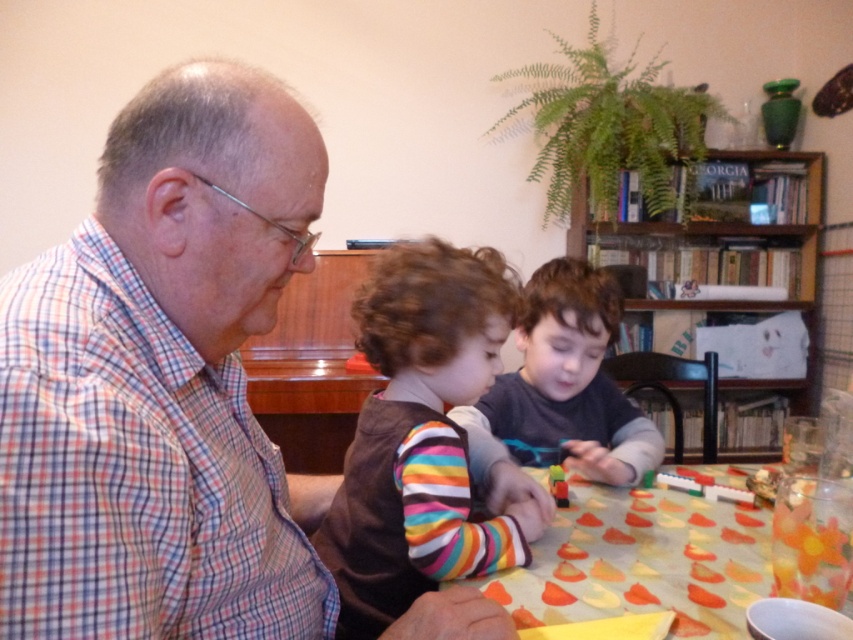
From the picture: Can you confirm if yellow paper at center is positioned to the right of dark gray sweater at center?

Yes, yellow paper at center is to the right of dark gray sweater at center.

Can you confirm if yellow paper at center is smaller than dark gray sweater at center?

Correct, yellow paper at center occupies less space than dark gray sweater at center.

This screenshot has height=640, width=853. What do you see at coordinates (642, 563) in the screenshot? I see `yellow paper at center` at bounding box center [642, 563].

I want to click on yellow paper at center, so (642, 563).

Is point (360, 627) positioned in front of point (643, 532)?

Yes.

Does brown fabric shirt at center appear under yellow paper at center?

Actually, brown fabric shirt at center is above yellow paper at center.

Is point (421, 538) positioned after point (555, 602)?

Yes, point (421, 538) is behind point (555, 602).

Locate an element on the screen. This screenshot has width=853, height=640. brown fabric shirt at center is located at coordinates (418, 435).

Can you confirm if brown fabric shirt at center is thinner than dark gray sweater at center?

Correct, brown fabric shirt at center's width is less than dark gray sweater at center's.

Between brown fabric shirt at center and dark gray sweater at center, which one has more height?

With more height is brown fabric shirt at center.

Does point (410, 259) come behind point (579, 470)?

No, (410, 259) is in front of (579, 470).

Find the location of `brown fabric shirt at center`. brown fabric shirt at center is located at coordinates (418, 435).